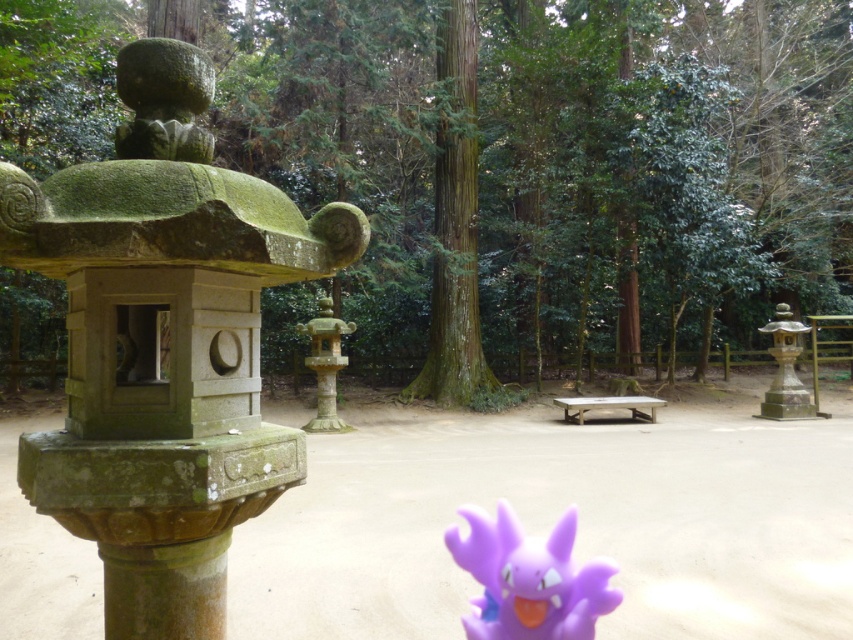
Does purple plastic toy at center appear on the right side of green mossy stone statue at upper left?

Correct, you'll find purple plastic toy at center to the right of green mossy stone statue at upper left.

Between point (584, 593) and point (206, 76), which one is positioned in front?

Point (584, 593) is in front.

Is point (492, 570) closer to camera compared to point (128, 80)?

Yes, it is.

Where is `purple plastic toy at center`? purple plastic toy at center is located at coordinates (529, 579).

Does green mossy stone lantern at left have a larger size compared to smooth stone lantern at center?

Incorrect, green mossy stone lantern at left is not larger than smooth stone lantern at center.

Identify the location of green mossy stone lantern at left. The image size is (853, 640). (160, 342).

At what (x,y) coordinates should I click in order to perform the action: click on green mossy stone lantern at left. Please return your answer as a coordinate pair (x, y). Looking at the image, I should click on (160, 342).

In the scene shown: Is green mossy stone statue at upper left further to the viewer compared to smooth stone lantern at center?

No, it is not.

Is point (148, 51) closer to camera compared to point (306, 360)?

Yes.

Is point (148, 124) closer to camera compared to point (314, 339)?

Yes, it is in front of point (314, 339).

Where is `green mossy stone statue at upper left`? green mossy stone statue at upper left is located at coordinates (164, 100).